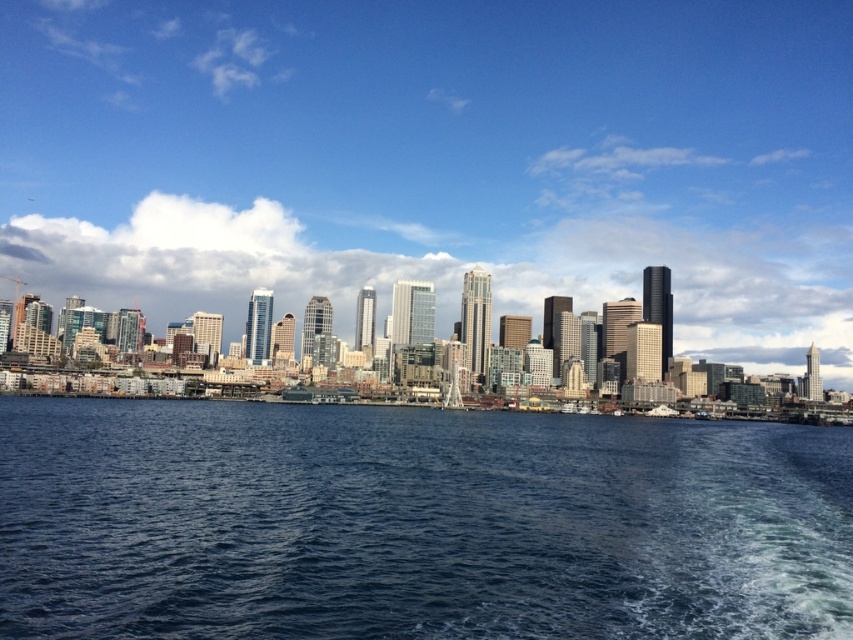
Is transparent glass skyscrapers at center taller than blue water at center?

Yes, transparent glass skyscrapers at center is taller than blue water at center.

Who is higher up, transparent glass skyscrapers at center or blue water at center?

Positioned higher is transparent glass skyscrapers at center.

Locate an element on the screen. Image resolution: width=853 pixels, height=640 pixels. transparent glass skyscrapers at center is located at coordinates (438, 160).

The height and width of the screenshot is (640, 853). Find the location of `transparent glass skyscrapers at center`. transparent glass skyscrapers at center is located at coordinates pos(438,160).